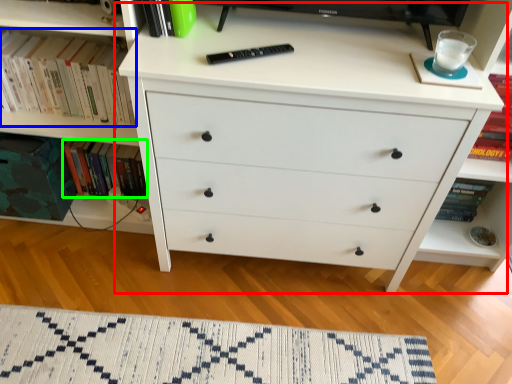
Question: Considering the real-world distances, which object is farthest from chest of drawers (highlighted by a red box)? book (highlighted by a blue box) or book (highlighted by a green box)?

Choices:
 (A) book
 (B) book

Answer: (B)